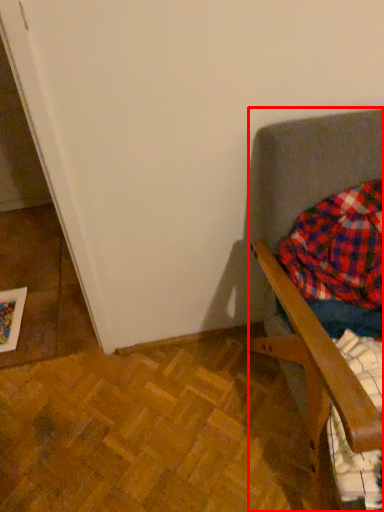
Question: From the image's perspective, where is furniture (annotated by the red box) located relative to flannel?

Choices:
 (A) above
 (B) below

Answer: (B)